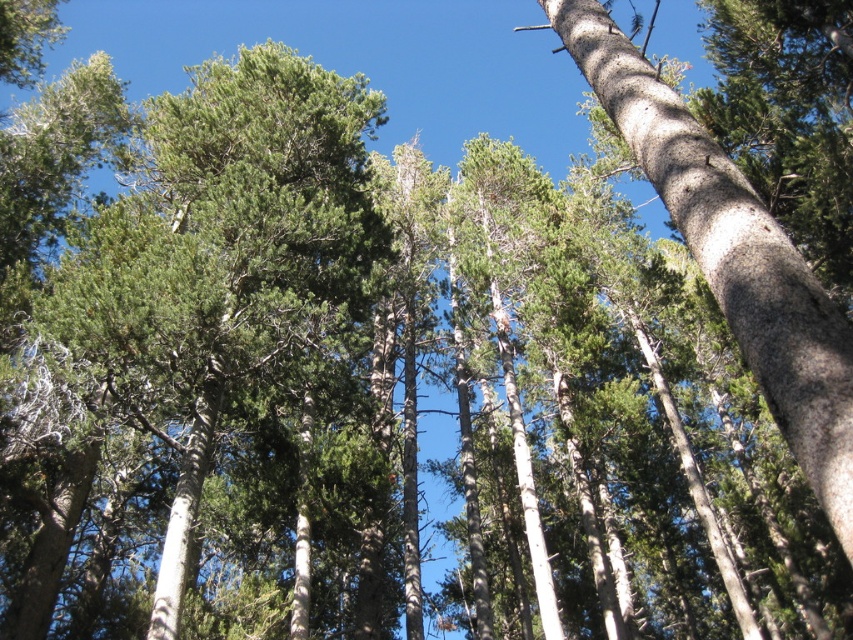
Does green needle-like at upper left lie in front of smooth gray bark at center?

No, it is not.

What do you see at coordinates (231, 275) in the screenshot?
I see `green needle-like at upper left` at bounding box center [231, 275].

Where is `green needle-like at upper left`? green needle-like at upper left is located at coordinates point(231,275).